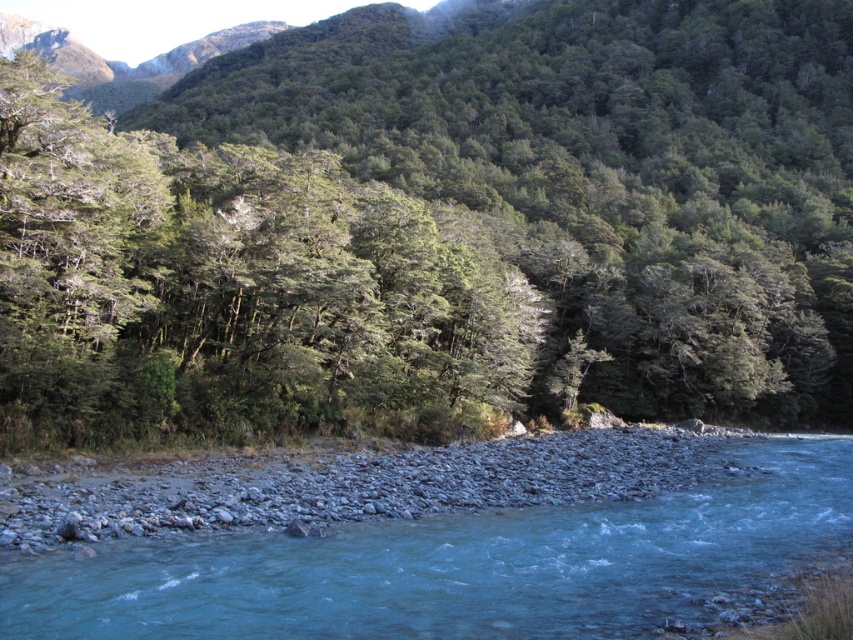
Question: Where is green leafy trees at center located in relation to clear blue water at center in the image?

Choices:
 (A) below
 (B) above

Answer: (B)

Question: Is green leafy trees at center positioned behind clear blue water at center?

Choices:
 (A) yes
 (B) no

Answer: (A)

Question: Is green leafy trees at center bigger than clear blue water at center?

Choices:
 (A) no
 (B) yes

Answer: (B)

Question: Which point is farther to the camera?

Choices:
 (A) (845, 435)
 (B) (705, 145)

Answer: (B)